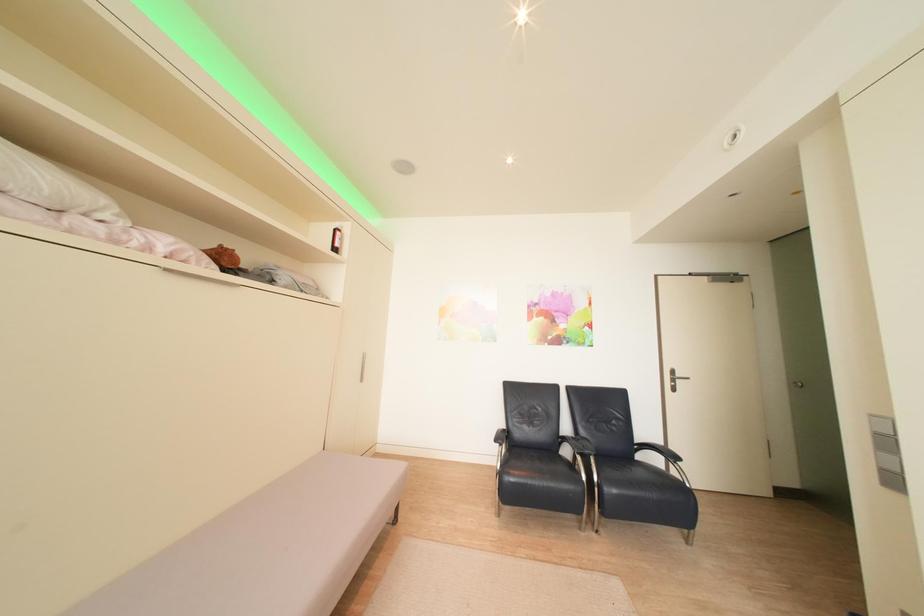
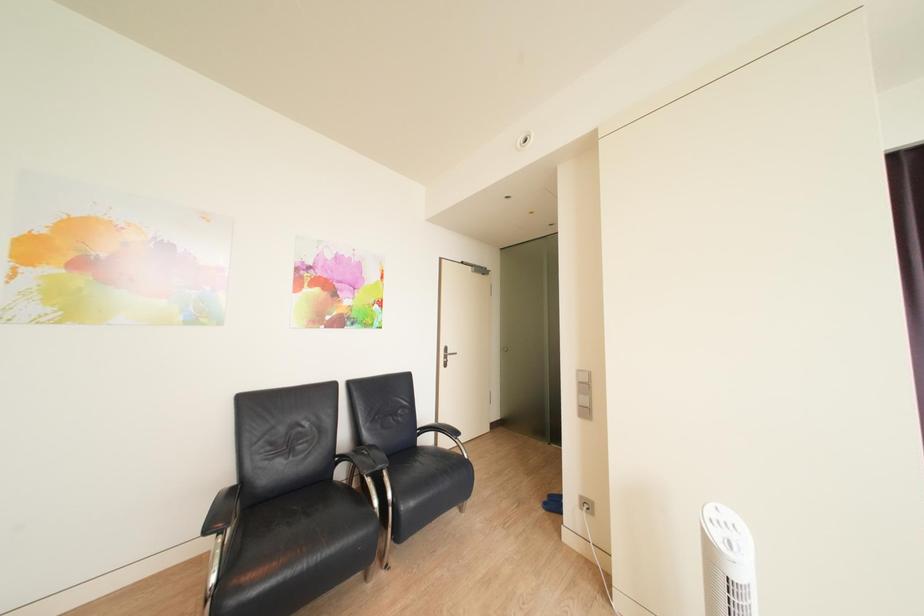
Question: The camera is either moving clockwise (left) or counter-clockwise (right) around the object. The first image is from the beginning of the video and the second image is from the end. Is the camera moving left or right when shooting the video?

Choices:
 (A) Left
 (B) Right

Answer: (A)